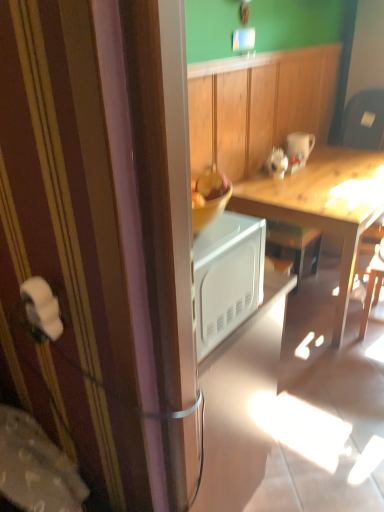
Question: Is wooden desk at center shorter than white glossy mug at upper right?

Choices:
 (A) yes
 (B) no

Answer: (B)

Question: Is wooden desk at center located outside white glossy mug at upper right?

Choices:
 (A) yes
 (B) no

Answer: (A)

Question: Is wooden desk at center oriented towards white glossy mug at upper right?

Choices:
 (A) yes
 (B) no

Answer: (B)

Question: From the image's perspective, does wooden desk at center appear lower than white glossy mug at upper right?

Choices:
 (A) no
 (B) yes

Answer: (B)

Question: Is wooden desk at center next to white glossy mug at upper right and touching it?

Choices:
 (A) no
 (B) yes

Answer: (A)

Question: From the image's perspective, is wooden desk at center located above white glossy mug at upper right?

Choices:
 (A) no
 (B) yes

Answer: (A)

Question: Is white glossy mug at upper right outside wooden desk at center?

Choices:
 (A) no
 (B) yes

Answer: (B)

Question: Considering the relative positions of white glossy mug at upper right and wooden desk at center in the image provided, is white glossy mug at upper right in front of wooden desk at center?

Choices:
 (A) yes
 (B) no

Answer: (B)

Question: Can you confirm if white glossy mug at upper right is bigger than wooden desk at center?

Choices:
 (A) no
 (B) yes

Answer: (A)

Question: Is white glossy mug at upper right shorter than wooden desk at center?

Choices:
 (A) yes
 (B) no

Answer: (A)

Question: Would you say white glossy mug at upper right contains wooden desk at center?

Choices:
 (A) no
 (B) yes

Answer: (A)

Question: Is white glossy mug at upper right to the left of wooden desk at center from the viewer's perspective?

Choices:
 (A) yes
 (B) no

Answer: (A)

Question: From a real-world perspective, is wooden desk at center positioned above or below white glossy mug at upper right?

Choices:
 (A) above
 (B) below

Answer: (B)